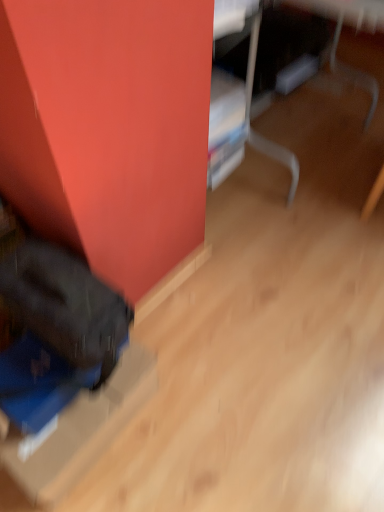
Question: Visually, is blue cardboard box at lower left positioned to the left or to the right of matte black bag at lower left?

Choices:
 (A) right
 (B) left

Answer: (B)

Question: Is blue cardboard box at lower left spatially inside matte black bag at lower left, or outside of it?

Choices:
 (A) outside
 (B) inside

Answer: (A)

Question: Is blue cardboard box at lower left in front of or behind matte black bag at lower left in the image?

Choices:
 (A) behind
 (B) front

Answer: (A)

Question: Is matte black bag at lower left inside or outside of blue cardboard box at lower left?

Choices:
 (A) outside
 (B) inside

Answer: (A)

Question: Is matte black bag at lower left to the left or to the right of blue cardboard box at lower left in the image?

Choices:
 (A) left
 (B) right

Answer: (B)

Question: In terms of width, does matte black bag at lower left look wider or thinner when compared to blue cardboard box at lower left?

Choices:
 (A) wide
 (B) thin

Answer: (A)

Question: Is point (205, 136) closer or farther from the camera than point (74, 470)?

Choices:
 (A) farther
 (B) closer

Answer: (A)